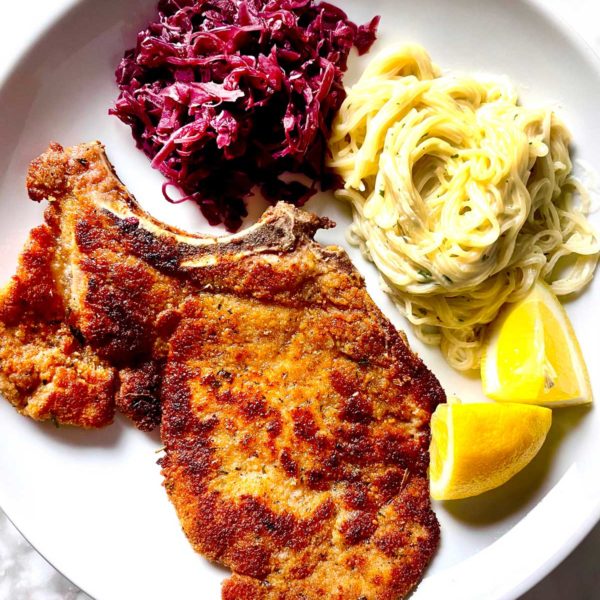
Image resolution: width=600 pixels, height=600 pixels. I want to click on white plate, so click(x=111, y=508).